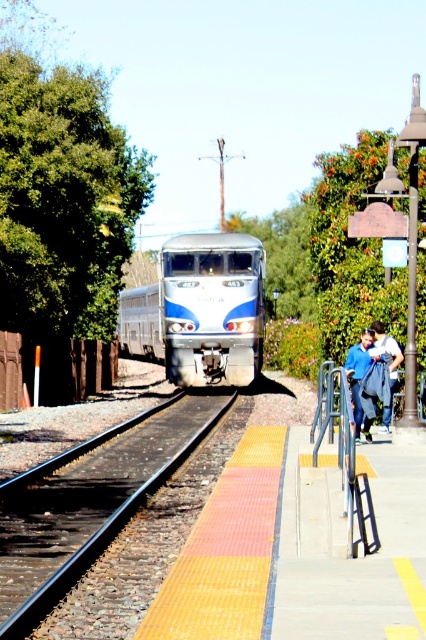
You are a passenger waiting at the train station. You see the black metal track at center and the blue fabric jacket at right. Which object is closer to the edge of the platform?

The blue fabric jacket at right is closer to the edge of the platform because the black metal track at center is positioned on the left side of it, meaning the jacket is further to the right near the edge.

You are standing on the platform at the train station. You see the black metal track at center and the blue fabric jacket at right. Which object is nearer to you?

The black metal track at center is closer to you than the blue fabric jacket at right.

You are a passenger waiting at the train station platform. You see a blue fabric jacket at right and a denim jacket at right. Which jacket is closer to the edge of the platform?

The blue fabric jacket at right is positioned on the left side of denim jacket at right, so the blue fabric jacket at right is closer to the edge of the platform since it is to the left of the denim jacket at right.